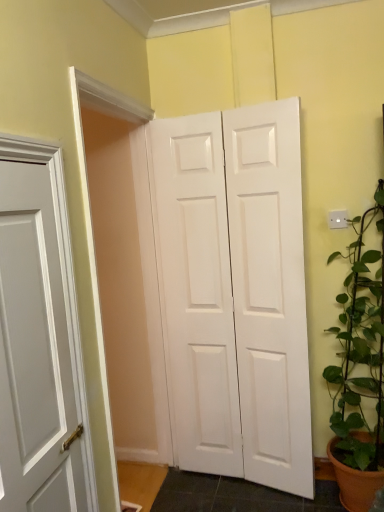
Where is `vacant space underneath white matte door at center (from a real-world perspective)`? vacant space underneath white matte door at center (from a real-world perspective) is located at coordinates (244, 484).